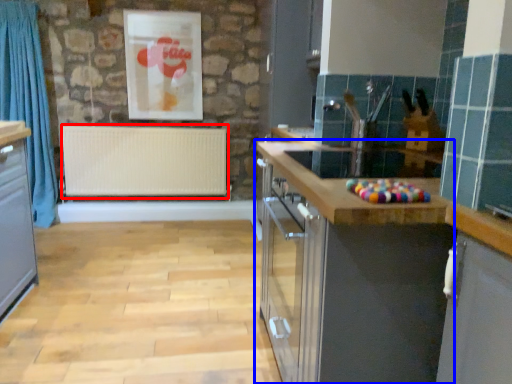
Question: Which point is closer to the camera, radiator (highlighted by a red box) or cabinetry (highlighted by a blue box)?

Choices:
 (A) radiator
 (B) cabinetry

Answer: (B)